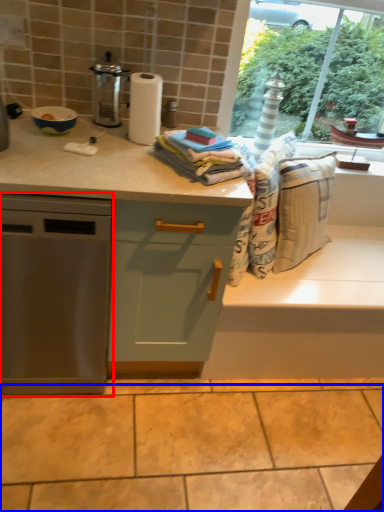
Question: Which object is closer to the camera taking this photo, home appliance (highlighted by a red box) or granite (highlighted by a blue box)?

Choices:
 (A) home appliance
 (B) granite

Answer: (A)